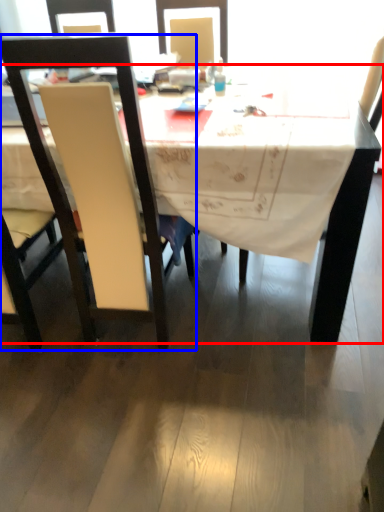
Question: Which of the following is the closest to the observer, desk (highlighted by a red box) or chair (highlighted by a blue box)?

Choices:
 (A) desk
 (B) chair

Answer: (B)